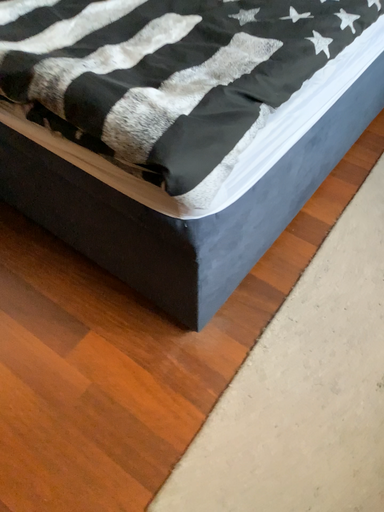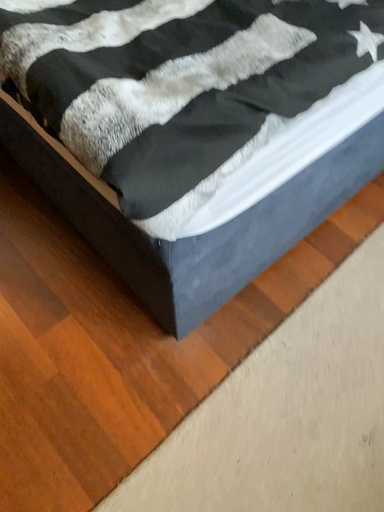
Question: Which way did the camera rotate in the video?

Choices:
 (A) rotated left
 (B) rotated right

Answer: (A)